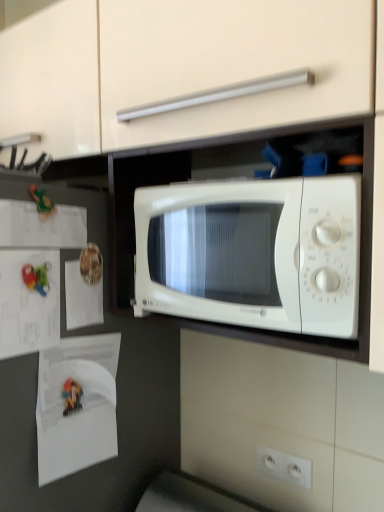
What do you see at coordinates (28, 303) in the screenshot? I see `white paper at left, marked as the second paper in a bottom-to-top arrangement` at bounding box center [28, 303].

Identify the location of green rubber toy at left. (42, 203).

The width and height of the screenshot is (384, 512). What do you see at coordinates (252, 253) in the screenshot?
I see `white matte microwave at center` at bounding box center [252, 253].

Describe the element at coordinates (81, 403) in the screenshot. I see `white paper at left, the 4th paper positioned from the top` at that location.

The height and width of the screenshot is (512, 384). I want to click on white plastic electric outlet at lower center, so click(284, 466).

From a real-world perspective, is green rubber toy at left located higher than white paper at left, which is the 2th paper in top-to-bottom order?

Yes.

Considering the positions of objects green rubber toy at left and white paper at left, arranged as the third paper when ordered from the bottom, in the image provided, who is more to the right, green rubber toy at left or white paper at left, arranged as the third paper when ordered from the bottom,?

white paper at left, arranged as the third paper when ordered from the bottom, is more to the right.

Looking at this image, is green rubber toy at left bigger than white paper at left, arranged as the third paper when ordered from the bottom?

Incorrect, green rubber toy at left is not larger than white paper at left, arranged as the third paper when ordered from the bottom.

From a real-world perspective, is white matte microwave at center under white plastic electric outlet at lower center?

No, from a real-world perspective, white matte microwave at center is not beneath white plastic electric outlet at lower center.

Is white matte microwave at center not within white plastic electric outlet at lower center?

Yes.

Which object is positioned more to the right, white matte microwave at center or white plastic electric outlet at lower center?

From the viewer's perspective, white plastic electric outlet at lower center appears more on the right side.

Considering the sizes of white paper at left, marked as the 1th paper in a top-to-bottom arrangement, and white paper at left, which is the 3th paper from top to bottom, in the image, is white paper at left, marked as the 1th paper in a top-to-bottom arrangement, bigger or smaller than white paper at left, which is the 3th paper from top to bottom,?

white paper at left, marked as the 1th paper in a top-to-bottom arrangement, is smaller than white paper at left, which is the 3th paper from top to bottom.

From a real-world perspective, is white paper at left, marked as the 4th paper in a bottom-to-top arrangement, physically located above or below white paper at left, which is the 3th paper from top to bottom?

white paper at left, marked as the 4th paper in a bottom-to-top arrangement, is above white paper at left, which is the 3th paper from top to bottom.

Identify the location of paper in front of the white paper at left, marked as the second paper in a bottom-to-top arrangement. (41, 226).

Is white paper at left, marked as the 4th paper in a bottom-to-top arrangement, far away from white paper at left, which is the 3th paper from top to bottom?

That's not correct — white paper at left, marked as the 4th paper in a bottom-to-top arrangement, is a little close to white paper at left, which is the 3th paper from top to bottom.

How different are the orientations of white paper at left, the 4th paper positioned from the top, and white paper at left, marked as the 1th paper in a top-to-bottom arrangement, in degrees?

They differ by 0.0105 degrees in their facing directions.

Who is bigger, white paper at left, the 4th paper positioned from the top, or white paper at left, marked as the 4th paper in a bottom-to-top arrangement?

Bigger between the two is white paper at left, the 4th paper positioned from the top.

In the scene shown: Is white paper at left, the 4th paper positioned from the top, oriented away from white paper at left, marked as the 1th paper in a top-to-bottom arrangement?

No, white paper at left, marked as the 1th paper in a top-to-bottom arrangement, is not at the back of white paper at left, the 4th paper positioned from the top.

Identify the location of the 2nd paper to the left of the white paper at left, the 1th paper in the bottom-to-top sequence, starting your count from the anchor. The height and width of the screenshot is (512, 384). (41, 226).

Is white paper at left, which is the 2th paper in top-to-bottom order, taller or shorter than white paper at left, marked as the 1th paper in a top-to-bottom arrangement?

white paper at left, which is the 2th paper in top-to-bottom order, is taller than white paper at left, marked as the 1th paper in a top-to-bottom arrangement.

From the image's perspective, is white paper at left, arranged as the third paper when ordered from the bottom, under white paper at left, marked as the 4th paper in a bottom-to-top arrangement?

Yes, from the image's perspective, white paper at left, arranged as the third paper when ordered from the bottom, is below white paper at left, marked as the 4th paper in a bottom-to-top arrangement.

Is white paper at left, arranged as the third paper when ordered from the bottom, oriented towards white paper at left, marked as the 4th paper in a bottom-to-top arrangement?

No, white paper at left, arranged as the third paper when ordered from the bottom, is not facing towards white paper at left, marked as the 4th paper in a bottom-to-top arrangement.

From a real-world perspective, is white paper at left, arranged as the third paper when ordered from the bottom, above or below white paper at left, marked as the 1th paper in a top-to-bottom arrangement?

From a real-world perspective, white paper at left, arranged as the third paper when ordered from the bottom, is physically below white paper at left, marked as the 1th paper in a top-to-bottom arrangement.

Which of these two, green rubber toy at left or white plastic electric outlet at lower center, is bigger?

Bigger between the two is white plastic electric outlet at lower center.

Is green rubber toy at left wider than white plastic electric outlet at lower center?

Incorrect, the width of green rubber toy at left does not surpass that of white plastic electric outlet at lower center.

From a real-world perspective, who is located lower, green rubber toy at left or white plastic electric outlet at lower center?

white plastic electric outlet at lower center, from a real-world perspective.

Measure the distance from white matte microwave at center to white paper at left, arranged as the third paper when ordered from the bottom.

white matte microwave at center and white paper at left, arranged as the third paper when ordered from the bottom, are 13.61 inches apart from each other.

Considering the positions of point (146, 223) and point (73, 282), is point (146, 223) closer or farther from the camera than point (73, 282)?

Point (146, 223) appears to be closer to the viewer than point (73, 282).

From a real-world perspective, is white matte microwave at center on top of white paper at left, arranged as the third paper when ordered from the bottom?

Yes, from a real-world perspective, white matte microwave at center is over white paper at left, arranged as the third paper when ordered from the bottom

Looking at this image, is white matte microwave at center in front of white paper at left, which is the 2th paper in top-to-bottom order?

Yes, white matte microwave at center is closer to the viewer.

The image size is (384, 512). I want to click on the 2nd paper to the right of the green rubber toy at left, counting from the anchor's position, so [82, 298].

The image size is (384, 512). I want to click on microwave oven located in front of the white plastic electric outlet at lower center, so click(x=252, y=253).

Which object lies nearer to the anchor point white paper at left, the 1th paper in the bottom-to-top sequence, white paper at left, which is the 2th paper in top-to-bottom order, or white paper at left, marked as the 4th paper in a bottom-to-top arrangement?

white paper at left, which is the 2th paper in top-to-bottom order, is closer to white paper at left, the 1th paper in the bottom-to-top sequence.

Looking at the image, which one is located further to white plastic electric outlet at lower center, green rubber toy at left or white paper at left, marked as the 4th paper in a bottom-to-top arrangement?

green rubber toy at left is further to white plastic electric outlet at lower center.

From the image, which object appears to be nearer to white matte microwave at center, white paper at left, which is the 3th paper from top to bottom, or green rubber toy at left?

white paper at left, which is the 3th paper from top to bottom, lies closer to white matte microwave at center than the other object.

Estimate the real-world distances between objects in this image. Which object is further from white paper at left, marked as the 1th paper in a top-to-bottom arrangement, white paper at left, which is the 3th paper from top to bottom, or white paper at left, the 4th paper positioned from the top?

white paper at left, the 4th paper positioned from the top, is further to white paper at left, marked as the 1th paper in a top-to-bottom arrangement.

Which object lies nearer to the anchor point white paper at left, the 4th paper positioned from the top, white paper at left, marked as the second paper in a bottom-to-top arrangement, or green rubber toy at left?

white paper at left, marked as the second paper in a bottom-to-top arrangement, lies closer to white paper at left, the 4th paper positioned from the top, than the other object.

When comparing their distances from green rubber toy at left, does white plastic electric outlet at lower center or white matte microwave at center seem further?

white plastic electric outlet at lower center is positioned further to the anchor green rubber toy at left.

From the image, which object appears to be farther from white plastic electric outlet at lower center, white paper at left, which is the 3th paper from top to bottom, or white paper at left, marked as the 4th paper in a bottom-to-top arrangement?

white paper at left, marked as the 4th paper in a bottom-to-top arrangement, lies further to white plastic electric outlet at lower center than the other object.

From the image, which object appears to be farther from green rubber toy at left, white paper at left, the 1th paper in the bottom-to-top sequence, or white paper at left, marked as the 4th paper in a bottom-to-top arrangement?

white paper at left, the 1th paper in the bottom-to-top sequence, is further to green rubber toy at left.

Where is `paper situated between white paper at left, arranged as the third paper when ordered from the bottom, and white plastic electric outlet at lower center from left to right`? This screenshot has height=512, width=384. paper situated between white paper at left, arranged as the third paper when ordered from the bottom, and white plastic electric outlet at lower center from left to right is located at coordinates (81, 403).

Find the location of `microwave oven between green rubber toy at left and white plastic electric outlet at lower center from top to bottom`. microwave oven between green rubber toy at left and white plastic electric outlet at lower center from top to bottom is located at coordinates (252, 253).

The width and height of the screenshot is (384, 512). I want to click on paper that lies between white paper at left, which is the 2th paper in top-to-bottom order, and white paper at left, the 1th paper in the bottom-to-top sequence, from top to bottom, so click(28, 303).

The image size is (384, 512). I want to click on microwave oven between white paper at left, which is the 3th paper from top to bottom, and white plastic electric outlet at lower center from left to right, so click(252, 253).